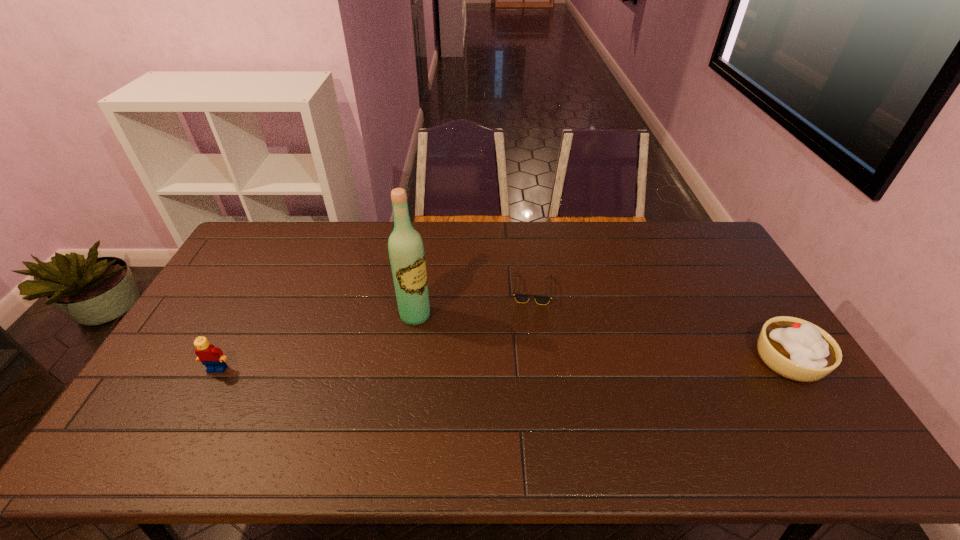
Image resolution: width=960 pixels, height=540 pixels. In order to click on free space between the Lego and the third object from right to left in this screenshot , I will do `click(317, 342)`.

This screenshot has width=960, height=540. Find the location of `object that stands as the third closest to the rightmost object`. object that stands as the third closest to the rightmost object is located at coordinates (212, 357).

Locate which object is the closest to the second object from right to left. Please provide its 2D coordinates. Your answer should be formatted as a tuple, i.e. [(x, y)], where the tuple contains the x and y coordinates of a point satisfying the conditions above.

[(406, 252)]